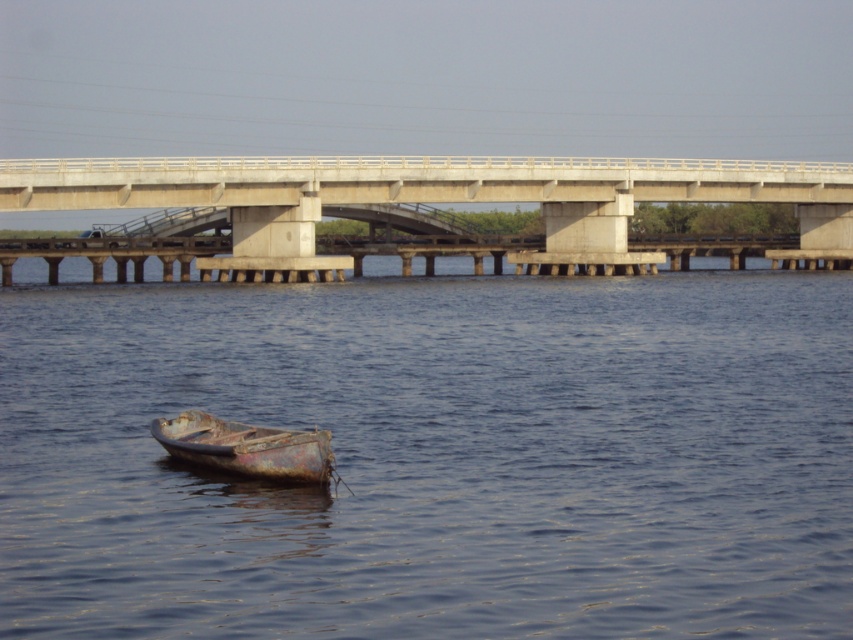
Question: Does blue metallic boat at lower left have a greater width compared to rusty metal boat at lower center?

Choices:
 (A) no
 (B) yes

Answer: (B)

Question: Estimate the real-world distances between objects in this image. Which object is closer to the concrete bridge at center?

Choices:
 (A) blue metallic boat at lower left
 (B) rusty metal boat at lower center

Answer: (A)

Question: Which object appears farthest from the camera in this image?

Choices:
 (A) concrete bridge at center
 (B) rusty metal boat at lower center

Answer: (A)

Question: Is blue metallic boat at lower left below rusty metal boat at lower center?

Choices:
 (A) no
 (B) yes

Answer: (A)

Question: Which object appears farthest from the camera in this image?

Choices:
 (A) concrete bridge at center
 (B) rusty metal boat at lower center

Answer: (A)

Question: Can you confirm if blue metallic boat at lower left is positioned below rusty metal boat at lower center?

Choices:
 (A) no
 (B) yes

Answer: (A)